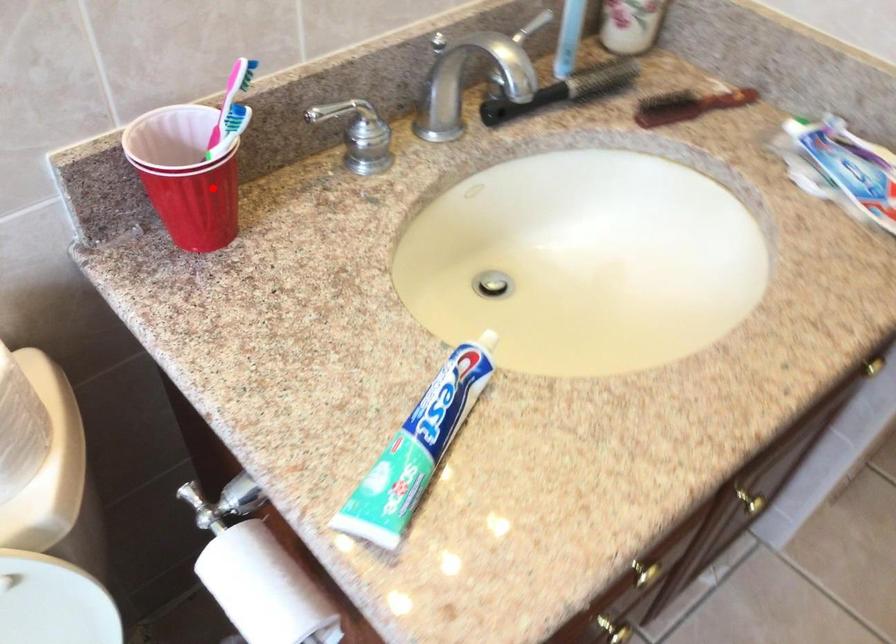
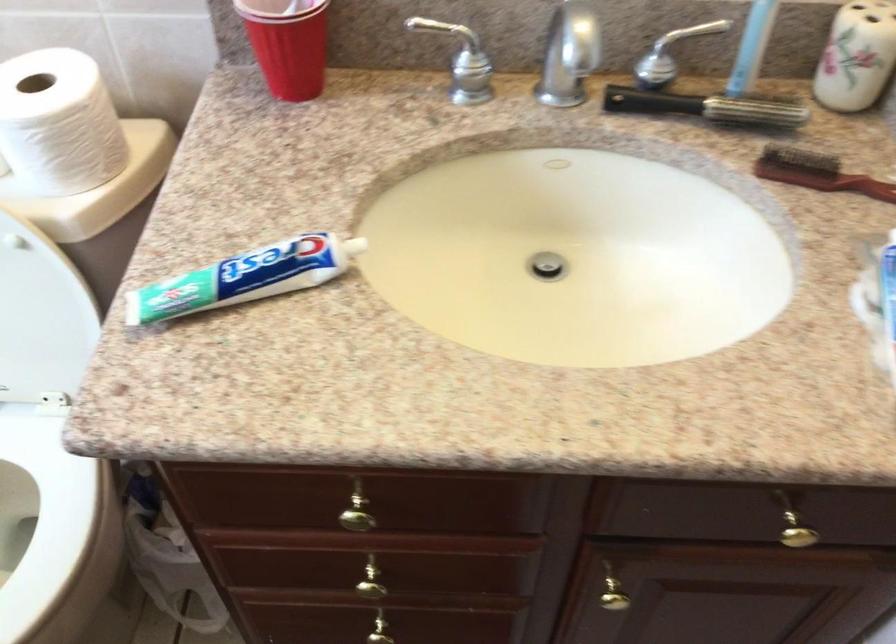
Question: I am providing you with two images of the same scene from different viewpoints. Image1 has a red point marked. In image2, the corresponding 3D location appears at what relative position? Reply with the corresponding letter.

Choices:
 (A) Closer
 (B) Farther

Answer: (B)